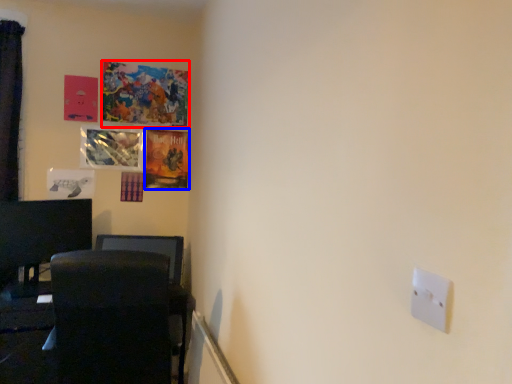
Question: Which object appears farthest to the camera in this image, picture frame (highlighted by a red box) or picture frame (highlighted by a blue box)?

Choices:
 (A) picture frame
 (B) picture frame

Answer: (B)